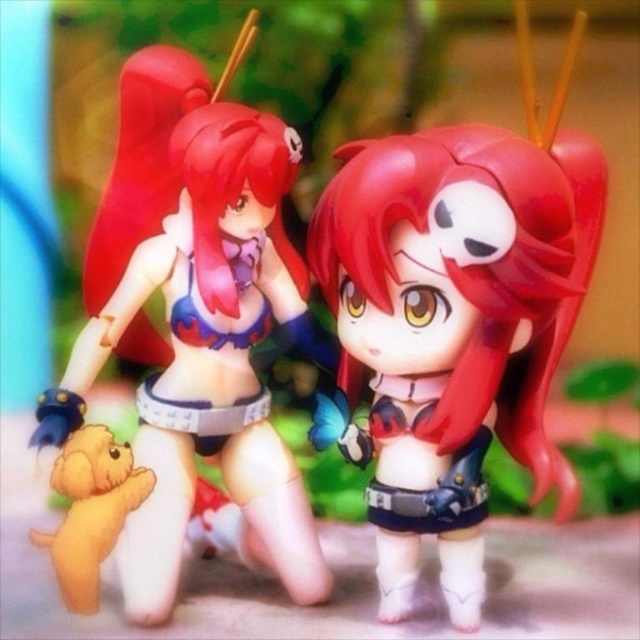
Question: Does matte plastic toy at center have a lesser width compared to soft yellow plush dog at lower left?

Choices:
 (A) yes
 (B) no

Answer: (B)

Question: Is matte plastic toy at center smaller than soft yellow plush dog at lower left?

Choices:
 (A) yes
 (B) no

Answer: (B)

Question: Can you confirm if satin red hair at center is positioned below matte plastic toy at center?

Choices:
 (A) no
 (B) yes

Answer: (A)

Question: Estimate the real-world distances between objects in this image. Which object is farther from the soft yellow plush dog at lower left?

Choices:
 (A) matte plastic toy at center
 (B) satin red hair at center

Answer: (B)

Question: Which point appears closest to the camera in this image?

Choices:
 (A) (364, 182)
 (B) (328, 340)

Answer: (A)

Question: Estimate the real-world distances between objects in this image. Which object is closer to the soft yellow plush dog at lower left?

Choices:
 (A) matte plastic toy at center
 (B) satin red hair at center

Answer: (A)